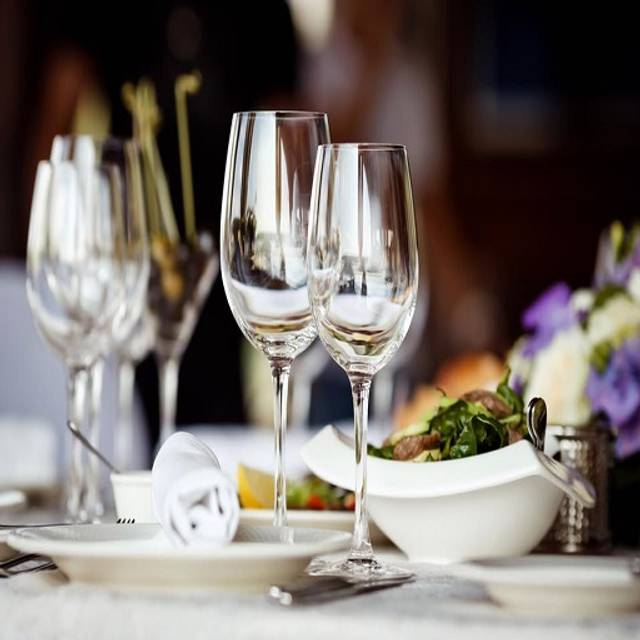
The height and width of the screenshot is (640, 640). I want to click on napkin, so click(169, 481).